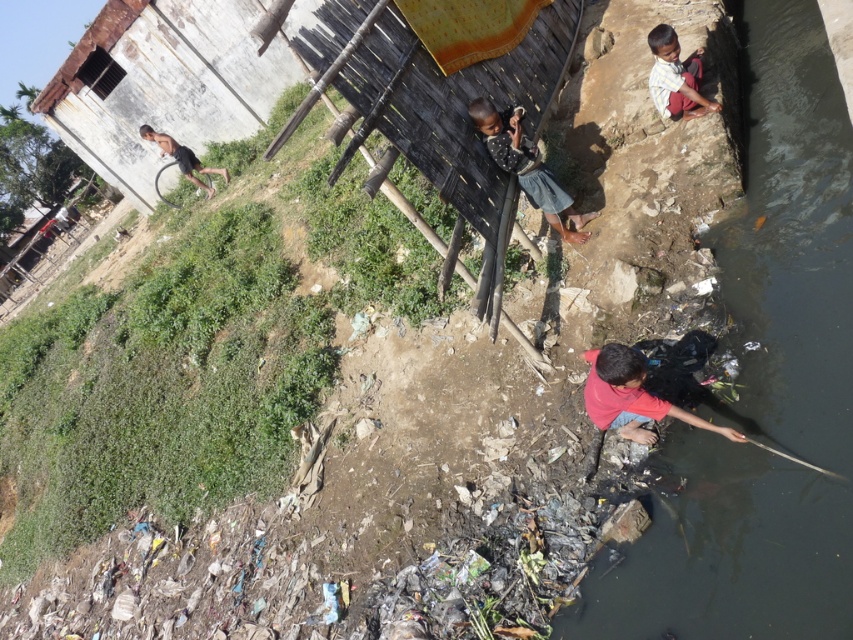
Who is taller, light brown skin at upper right or light brown skin child at left?

light brown skin child at left

Who is lower down, light brown skin at upper right or light brown skin child at left?

light brown skin at upper right is lower down.

Which is behind, point (674, 99) or point (210, 168)?

Point (210, 168)

You are a GUI agent. You are given a task and a screenshot of the screen. Output one action in this format:
    pyautogui.click(x=<x>, y=<y>)
    Task: Click on the light brown skin at upper right
    The image size is (853, 640).
    Given the screenshot: What is the action you would take?
    pyautogui.click(x=676, y=77)

Is dark murky water at right smaller than red matte shirt at lower right?

Yes, dark murky water at right is smaller than red matte shirt at lower right.

Who is more forward, (737,525) or (593,374)?

Point (737,525)

Where is `dark murky water at right`? dark murky water at right is located at coordinates [x=759, y=384].

The width and height of the screenshot is (853, 640). Describe the element at coordinates (759, 384) in the screenshot. I see `dark murky water at right` at that location.

Who is more distant from viewer, (x=624, y=573) or (x=579, y=212)?

The point (x=579, y=212) is behind.

The height and width of the screenshot is (640, 853). In order to click on dark murky water at right in this screenshot , I will do `click(759, 384)`.